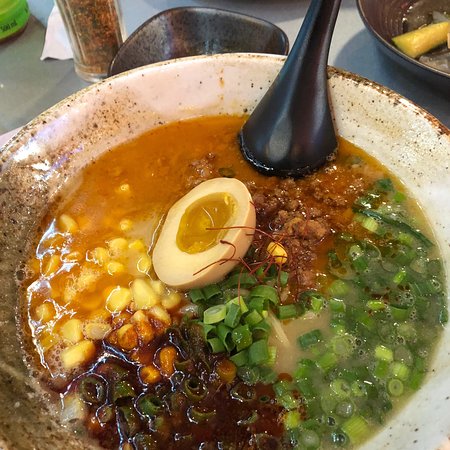
Identify the location of bowl of veggies. (402, 13).